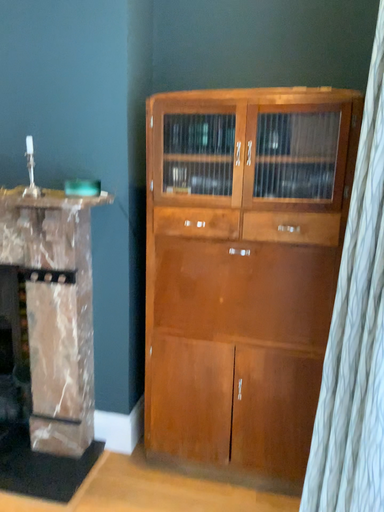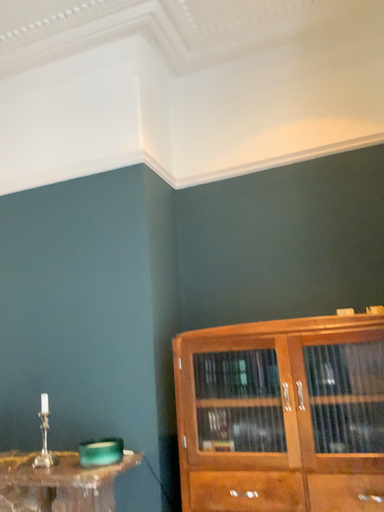
Question: How did the camera likely rotate when shooting the video?

Choices:
 (A) rotated right
 (B) rotated left

Answer: (B)